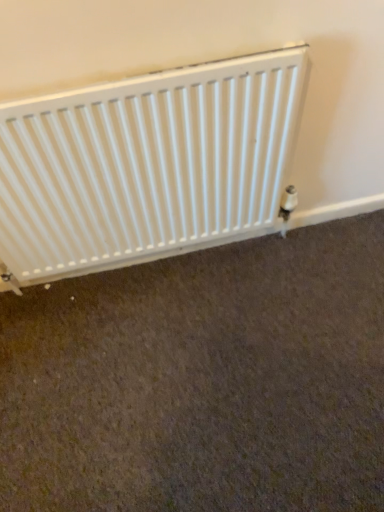
Describe the element at coordinates (148, 166) in the screenshot. This screenshot has height=512, width=384. I see `white matte radiator at center` at that location.

Locate an element on the screen. This screenshot has width=384, height=512. white matte radiator at center is located at coordinates (148, 166).

Locate an element on the screen. This screenshot has height=512, width=384. white matte radiator at center is located at coordinates (148, 166).